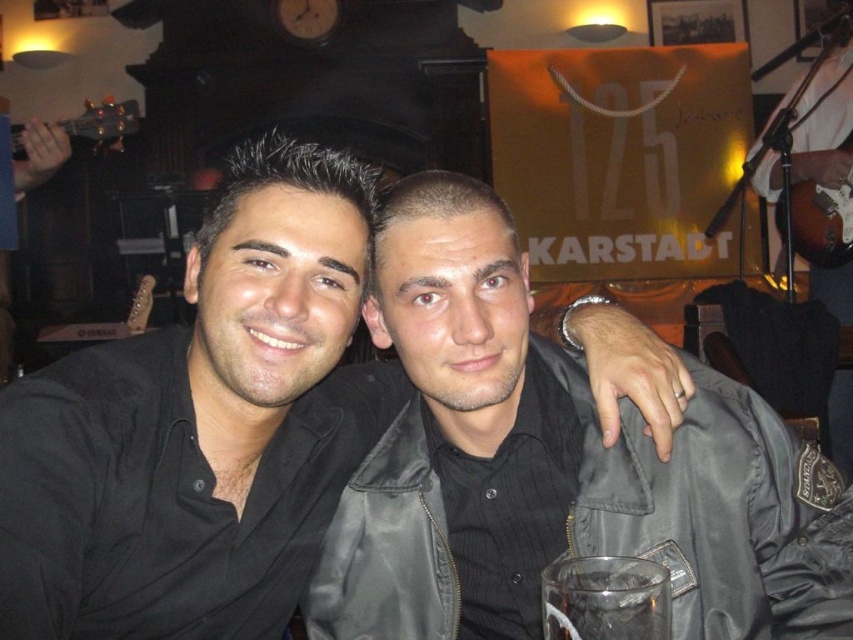
Question: Can you confirm if black matte shirt at center is positioned above black leather jacket at center?

Choices:
 (A) no
 (B) yes

Answer: (B)

Question: Does black leather jacket at center have a larger size compared to clear glass at lower center?

Choices:
 (A) no
 (B) yes

Answer: (B)

Question: Is black matte shirt at center to the left of clear glass at lower center from the viewer's perspective?

Choices:
 (A) no
 (B) yes

Answer: (B)

Question: Which of the following is the closest to the observer?

Choices:
 (A) black leather jacket at center
 (B) clear glass at lower center

Answer: (B)

Question: Which object appears closest to the camera in this image?

Choices:
 (A) clear glass at lower center
 (B) black matte shirt at center
 (C) black leather jacket at center

Answer: (A)

Question: Among these points, which one is farthest from the camera?

Choices:
 (A) (552, 596)
 (B) (811, 564)

Answer: (B)